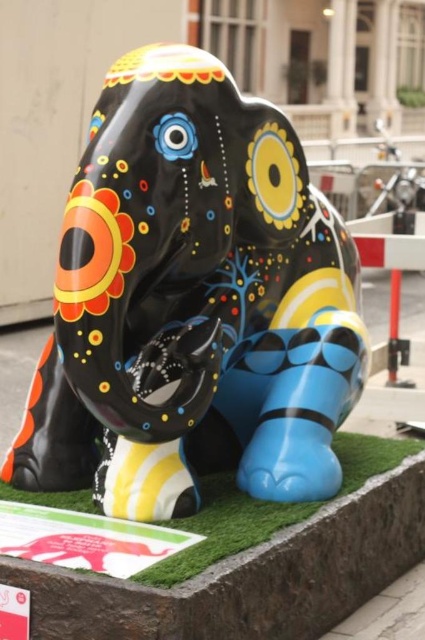
Which of these two, glossy painted elephant at center or green artificial turf at lower center, stands shorter?

Standing shorter between the two is green artificial turf at lower center.

Between glossy painted elephant at center and green artificial turf at lower center, which one is positioned lower?

green artificial turf at lower center is lower down.

Between point (187, 422) and point (229, 525), which one is positioned in front?

Point (229, 525) is in front.

Where is `glossy painted elephant at center`? Image resolution: width=425 pixels, height=640 pixels. glossy painted elephant at center is located at coordinates (192, 304).